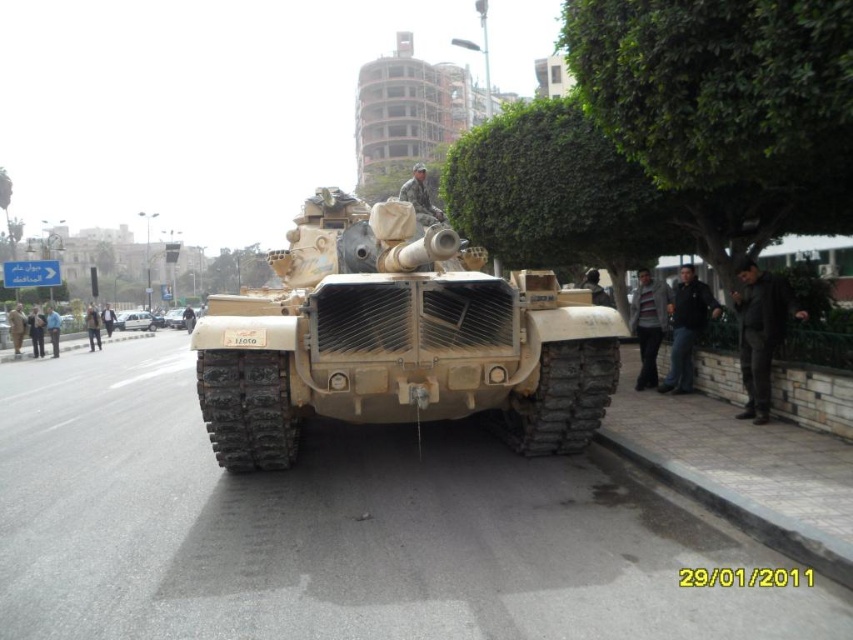
Is camouflage textured tank at center closer to camera compared to camouflage fabric tank at center?

Yes, it is.

Does point (283, 362) come farther from viewer compared to point (151, 317)?

That is False.

Between point (273, 292) and point (137, 314), which one is positioned behind?

The point (137, 314) is behind.

This screenshot has width=853, height=640. I want to click on camouflage textured tank at center, so click(x=398, y=339).